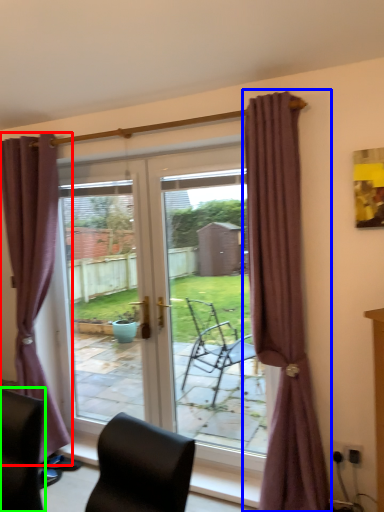
Question: Which is nearer to the curtain (highlighted by a red box)? curtain (highlighted by a blue box) or chair (highlighted by a green box).

Choices:
 (A) curtain
 (B) chair

Answer: (B)